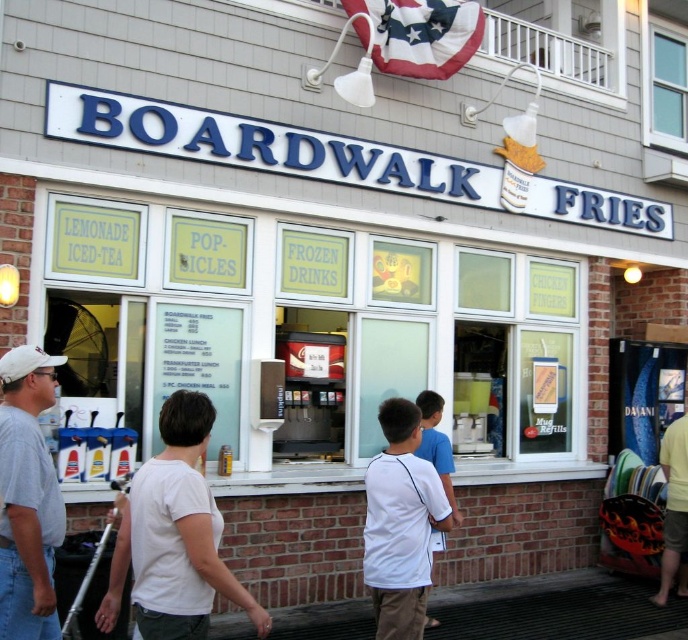
Is white matte t-shirt at center taller than white cotton shirt at center?

Correct, white matte t-shirt at center is much taller as white cotton shirt at center.

Is white matte t-shirt at center above white cotton shirt at center?

Yes, white matte t-shirt at center is above white cotton shirt at center.

This screenshot has width=688, height=640. In order to click on white matte t-shirt at center in this screenshot , I will do `click(175, 532)`.

Does white matte t-shirt at center have a greater width compared to white matte shirt at center?

Yes, white matte t-shirt at center is wider than white matte shirt at center.

Is white matte t-shirt at center bigger than white matte shirt at center?

Yes.

Measure the distance between point (182, 554) and camera.

A distance of 3.16 meters exists between point (182, 554) and camera.

Identify the location of white matte t-shirt at center. This screenshot has width=688, height=640. (175, 532).

Does white matte t-shirt at center appear over gray cotton t-shirt at left?

Incorrect, white matte t-shirt at center is not positioned above gray cotton t-shirt at left.

Who is higher up, white matte t-shirt at center or gray cotton t-shirt at left?

gray cotton t-shirt at left is higher up.

Between point (147, 609) and point (1, 481), which one is positioned behind?

The point (1, 481) is more distant.

Identify the location of white matte t-shirt at center. (175, 532).